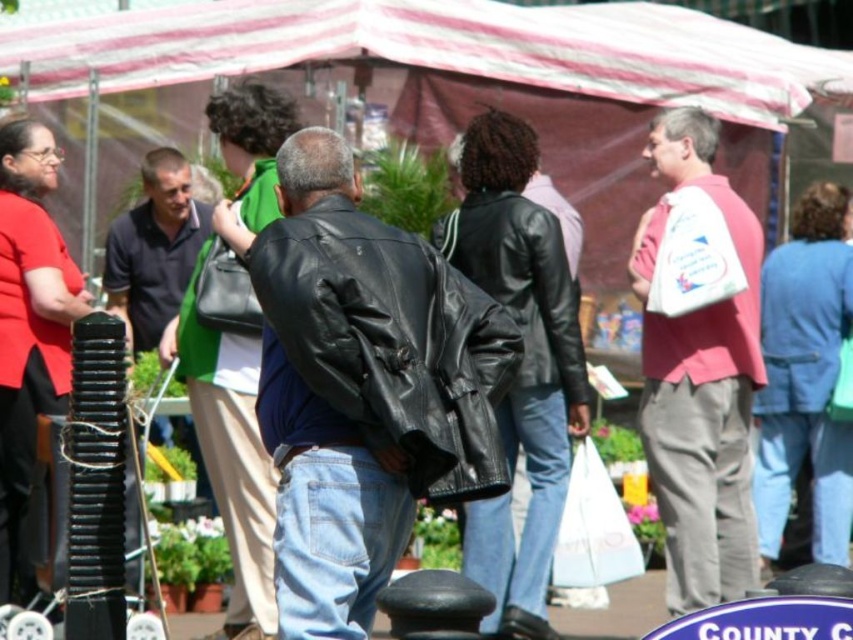
Is white plastic bag at right below dark green fabric bag at center?

Yes.

Between white plastic bag at right and dark green fabric bag at center, which one appears on the right side from the viewer's perspective?

Positioned to the right is white plastic bag at right.

Where is `white plastic bag at right`? The width and height of the screenshot is (853, 640). white plastic bag at right is located at coordinates (701, 394).

Which is more to the right, shiny black leather jacket at center or white plastic bag at right?

Positioned to the right is white plastic bag at right.

Is point (370, 356) less distant than point (693, 140)?

Yes, point (370, 356) is in front of point (693, 140).

This screenshot has width=853, height=640. What are the coordinates of `shiny black leather jacket at center` in the screenshot? It's located at (364, 388).

Between shiny black leather jacket at center and dark green fabric bag at center, which one is positioned lower?

shiny black leather jacket at center is below.

Who is higher up, shiny black leather jacket at center or dark green fabric bag at center?

dark green fabric bag at center

Which is behind, point (451, 376) or point (184, 212)?

The point (184, 212) is behind.

Image resolution: width=853 pixels, height=640 pixels. In order to click on shiny black leather jacket at center in this screenshot , I will do `click(364, 388)`.